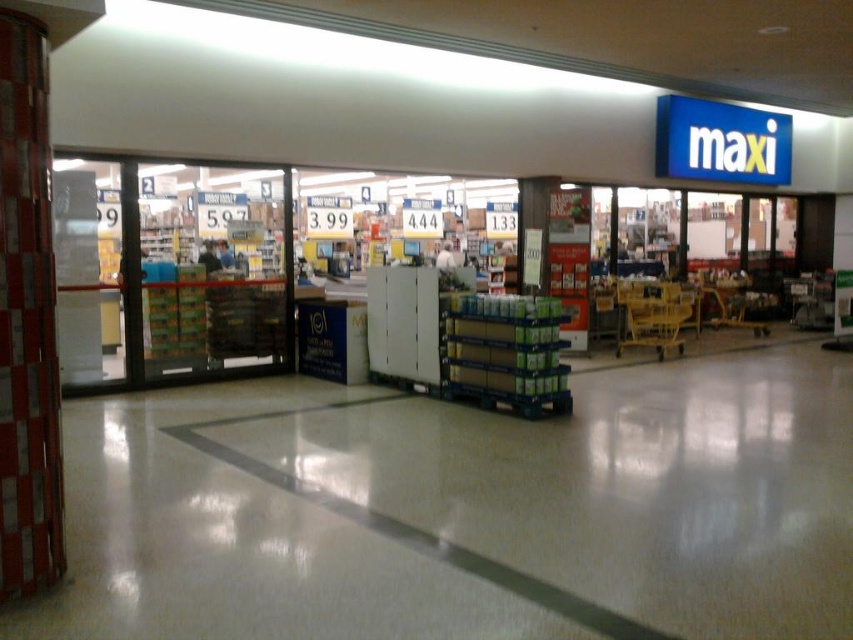
From the picture: Is white plastic shelves at center smaller than yellow plastic shopping cart at center?

Incorrect, white plastic shelves at center is not smaller in size than yellow plastic shopping cart at center.

Does point (172, 248) come behind point (653, 324)?

No, (172, 248) is closer to viewer.

Which is behind, point (312, 204) or point (619, 346)?

The point (619, 346) is more distant.

The width and height of the screenshot is (853, 640). Identify the location of white plastic shelves at center. (172, 298).